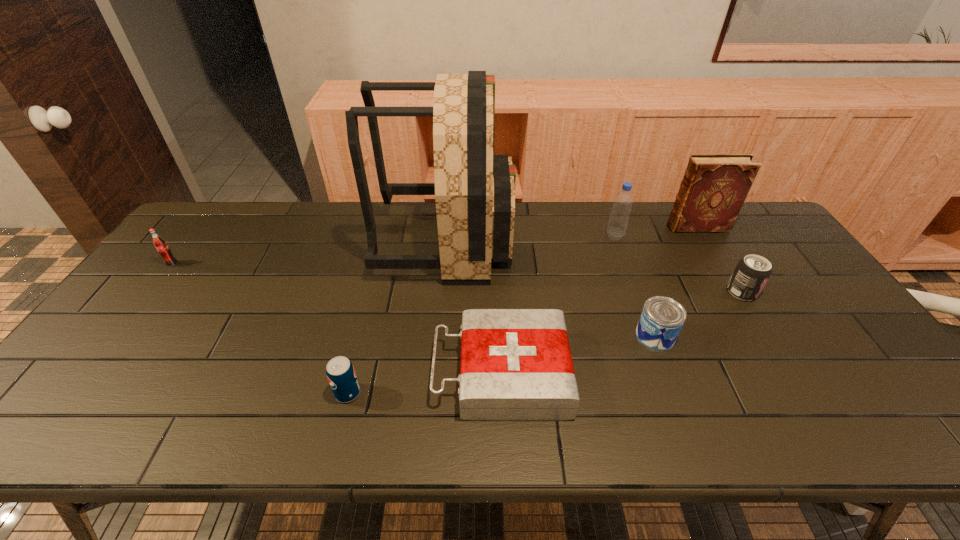
Identify the location of free space between the first-aid kit and the nearest pop. This screenshot has width=960, height=540. (424, 383).

Locate an element on the screen. The width and height of the screenshot is (960, 540). free space between the first-aid kit and the bottle is located at coordinates (558, 305).

Where is `vacant point located between the can and the second farthest pop`? vacant point located between the can and the second farthest pop is located at coordinates (698, 314).

The image size is (960, 540). I want to click on free space between the backpack and the can, so click(x=551, y=288).

Choose which object is the seventh nearest neighbor to the hardback book. Please provide its 2D coordinates. Your answer should be formatted as a tuple, i.e. [(x, y)], where the tuple contains the x and y coordinates of a point satisfying the conditions above.

[(159, 243)]

You are a GUI agent. You are given a task and a screenshot of the screen. Output one action in this format:
    pyautogui.click(x=<x>, y=<y>)
    Task: Click on the object that can be found as the sixth closest to the second farthest pop
    
    Given the screenshot: What is the action you would take?
    pyautogui.click(x=341, y=375)

The height and width of the screenshot is (540, 960). In order to click on the closest pop to the nearest pop in this screenshot , I will do `click(159, 243)`.

Identify which pop is located as the third nearest to the first-aid kit. Please provide its 2D coordinates. Your answer should be formatted as a tuple, i.e. [(x, y)], where the tuple contains the x and y coordinates of a point satisfying the conditions above.

[(159, 243)]

At what (x,y) coordinates should I click in order to perform the action: click on free space in the image that satisfies the following two spatial constraints: 1. on the label of the farthest pop; 2. on the left side of the nearest pop. Please return your answer as a coordinate pair (x, y). The height and width of the screenshot is (540, 960). Looking at the image, I should click on (72, 393).

Where is `free space that satisfies the following two spatial constraints: 1. on the label of the nearest pop; 2. on the left side of the leftmost pop`? The height and width of the screenshot is (540, 960). free space that satisfies the following two spatial constraints: 1. on the label of the nearest pop; 2. on the left side of the leftmost pop is located at coordinates (72, 393).